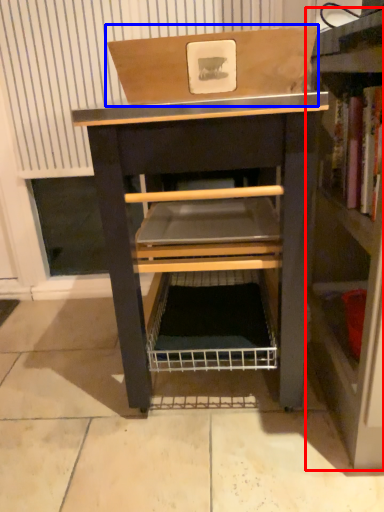
Question: Which object is further to the camera taking this photo, shelf (highlighted by a red box) or cardboard box (highlighted by a blue box)?

Choices:
 (A) shelf
 (B) cardboard box

Answer: (B)